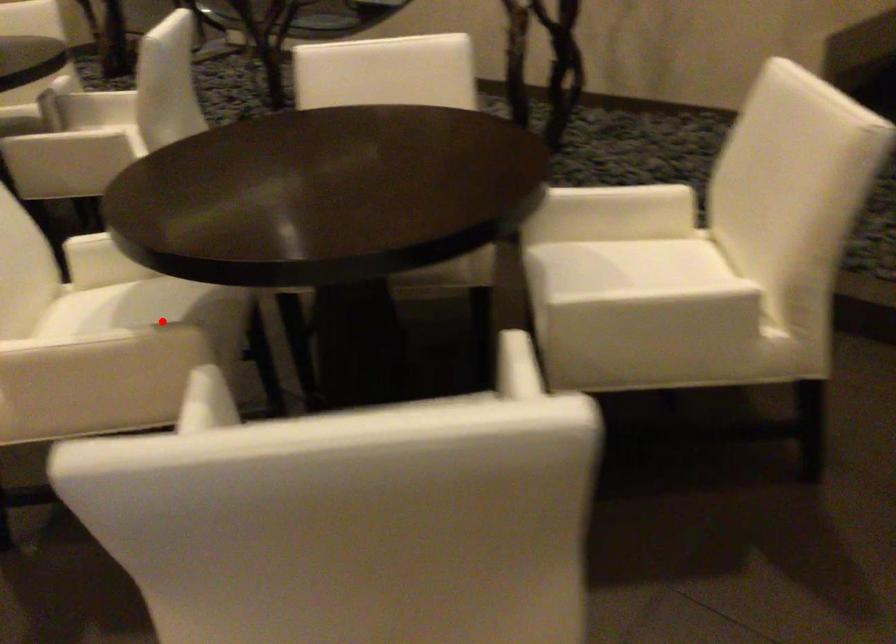
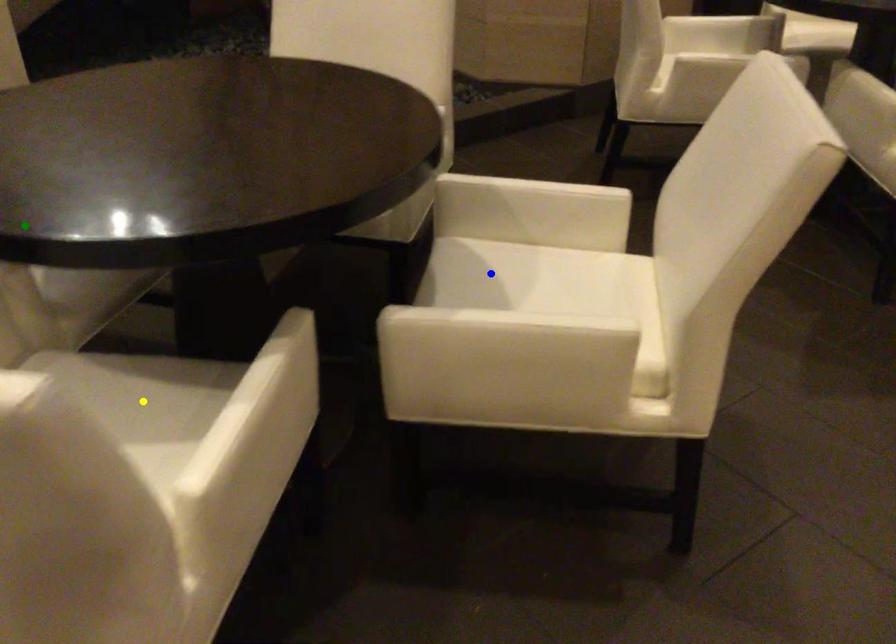
Question: I am providing you with two images of the same scene from different viewpoints. A red point is marked on the first image. You are given multiple points on the second image. Which mark in image 2 goes with the point in image 1?

Choices:
 (A) yellow point
 (B) green point
 (C) blue point

Answer: (A)